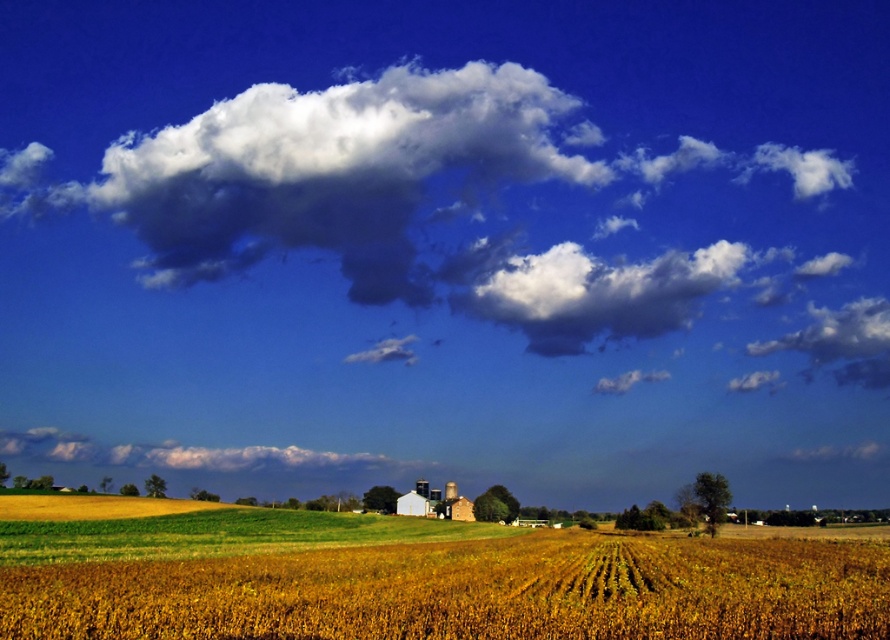
You are a farmer standing in the middle of your field. You notice the yellow matte wheat field at center and the white fluffy cloud at upper center. Which object is closer to you?

The yellow matte wheat field at center is closer to you because it is in front of the white fluffy cloud at upper center.

You are a drone operator flying over a rural area and need to locate the yellow matte wheat field at center. According to the coordinates provided, where would you direct the drone to find it?

The yellow matte wheat field at center is located at the 2D coordinates point of (x=471, y=592).